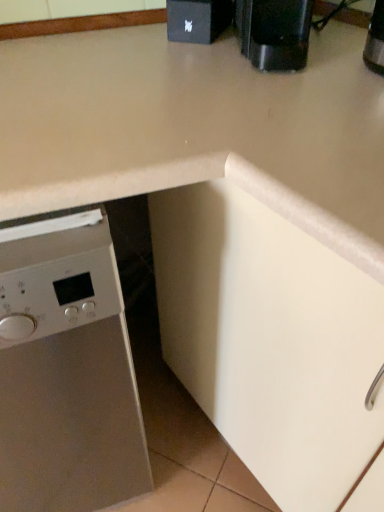
Describe the element at coordinates (198, 20) in the screenshot. I see `black matte speaker at upper center` at that location.

I want to click on satin white dishwasher at left, so click(x=66, y=372).

Which is behind, point (229, 5) or point (249, 27)?

Point (229, 5)

You are a GUI agent. You are given a task and a screenshot of the screen. Output one action in this format:
    pyautogui.click(x=<x>, y=<y>)
    Task: Click on the coffee machine that is on the right side of black matte speaker at upper center
    This screenshot has height=512, width=384.
    Given the screenshot: What is the action you would take?
    point(275,33)

Does black matte speaker at upper center contain black plastic coffee machine at upper right?

No, black plastic coffee machine at upper right is not a part of black matte speaker at upper center.

Is satin white dishwasher at left shorter than black plastic coffee machine at upper right?

No.

In the image, there is a black plastic coffee machine at upper right. Identify the location of home appliance below it (from the image's perspective). (66, 372).

From a real-world perspective, which object stands above the other?

black plastic coffee machine at upper right, from a real-world perspective.

Is satin white dishwasher at left turned away from black plastic coffee machine at upper right?

No, satin white dishwasher at left is not facing the opposite direction of black plastic coffee machine at upper right.

Between black plastic coffee machine at upper right and black matte speaker at upper center, which one appears on the left side from the viewer's perspective?

black matte speaker at upper center is more to the left.

Between black plastic coffee machine at upper right and black matte speaker at upper center, which one is positioned behind?

Positioned behind is black matte speaker at upper center.

Can you confirm if black plastic coffee machine at upper right is bigger than black matte speaker at upper center?

Indeed, black plastic coffee machine at upper right has a larger size compared to black matte speaker at upper center.

Is point (253, 36) less distant than point (202, 42)?

Yes, point (253, 36) is closer to viewer.

Is satin white dishwasher at left aimed at black matte speaker at upper center?

No.

Looking at the image, does satin white dishwasher at left seem bigger or smaller compared to black matte speaker at upper center?

satin white dishwasher at left is bigger than black matte speaker at upper center.

Which object is positioned more to the left, satin white dishwasher at left or black matte speaker at upper center?

satin white dishwasher at left.

Could satin white dishwasher at left be considered to be inside black plastic coffee machine at upper right?

No, satin white dishwasher at left is not inside black plastic coffee machine at upper right.

Can you confirm if black plastic coffee machine at upper right is bigger than satin white dishwasher at left?

No, black plastic coffee machine at upper right is not bigger than satin white dishwasher at left.

Is black plastic coffee machine at upper right at the left side of satin white dishwasher at left?

No, black plastic coffee machine at upper right is not to the left of satin white dishwasher at left.

Is black plastic coffee machine at upper right turned away from satin white dishwasher at left?

No, black plastic coffee machine at upper right is not facing away from satin white dishwasher at left.

Is black matte speaker at upper center positioned with its back to satin white dishwasher at left?

black matte speaker at upper center does not have its back to satin white dishwasher at left.

Is point (169, 24) positioned before point (128, 420)?

No.

Is black matte speaker at upper center taller or shorter than satin white dishwasher at left?

In the image, black matte speaker at upper center appears to be shorter than satin white dishwasher at left.

Where is `coffee machine that appears in front of the black matte speaker at upper center`? This screenshot has height=512, width=384. coffee machine that appears in front of the black matte speaker at upper center is located at coordinates (275, 33).

The height and width of the screenshot is (512, 384). I want to click on coffee machine on the right side of satin white dishwasher at left, so click(275, 33).

Looking at this image, considering their positions, is black plastic coffee machine at upper right positioned closer to satin white dishwasher at left than black matte speaker at upper center?

Based on the image, black plastic coffee machine at upper right appears to be nearer to satin white dishwasher at left.

Based on their spatial positions, is black matte speaker at upper center or black plastic coffee machine at upper right further from satin white dishwasher at left?

black matte speaker at upper center is positioned further to the anchor satin white dishwasher at left.

When comparing their distances from black plastic coffee machine at upper right, does black matte speaker at upper center or satin white dishwasher at left seem further?

satin white dishwasher at left lies further to black plastic coffee machine at upper right than the other object.

Looking at the image, which one is located closer to black matte speaker at upper center, satin white dishwasher at left or black plastic coffee machine at upper right?

Among the two, black plastic coffee machine at upper right is located nearer to black matte speaker at upper center.

Consider the image. Which object lies nearer to the anchor point black plastic coffee machine at upper right, satin white dishwasher at left or black matte speaker at upper center?

black matte speaker at upper center lies closer to black plastic coffee machine at upper right than the other object.

Estimate the real-world distances between objects in this image. Which object is further from black matte speaker at upper center, black plastic coffee machine at upper right or satin white dishwasher at left?

Based on the image, satin white dishwasher at left appears to be further to black matte speaker at upper center.

The image size is (384, 512). Find the location of `coffee machine between black matte speaker at upper center and satin white dishwasher at left in the vertical direction`. coffee machine between black matte speaker at upper center and satin white dishwasher at left in the vertical direction is located at coordinates (275, 33).